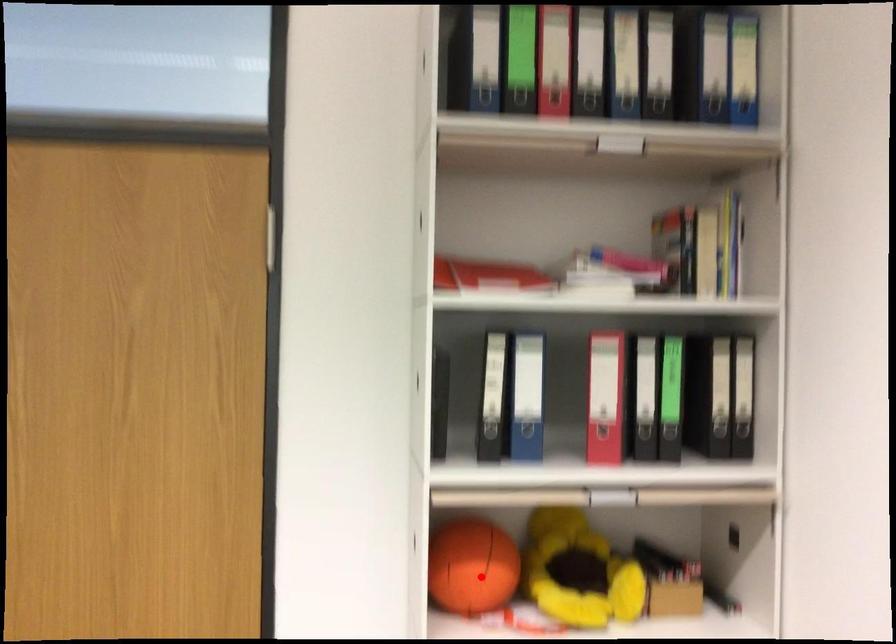
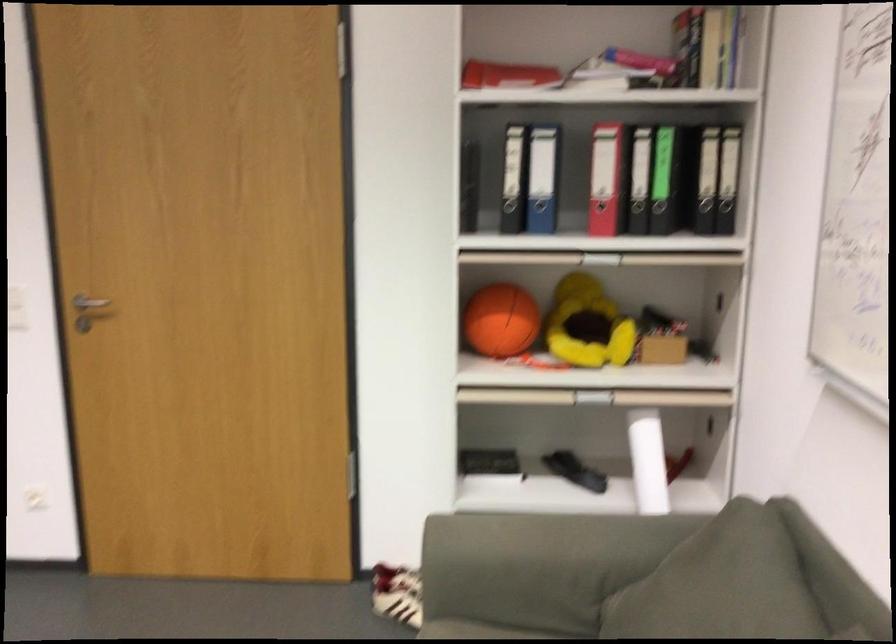
In the second image, find the point that corresponds to the highlighted location in the first image.

(501, 321)